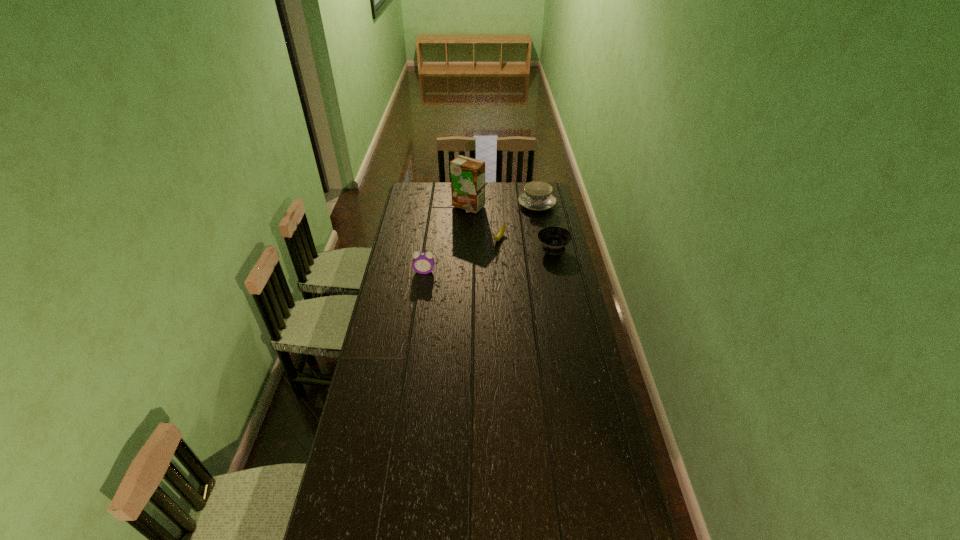
Locate which object is the second closest to the banana. Please provide its 2D coordinates. Your answer should be formatted as a tuple, i.e. [(x, y)], where the tuple contains the x and y coordinates of a point satisfying the conditions above.

[(467, 174)]

This screenshot has width=960, height=540. I want to click on object that is the fourth nearest to the tallest object, so click(423, 262).

Locate an element on the screen. free spot that satisfies the following two spatial constraints: 1. on the front side of the bowl; 2. on the left side of the carton is located at coordinates (467, 249).

Find the location of `free space that satisfies the following two spatial constraints: 1. on the back side of the third object from right to left; 2. on the left side of the chinaware`. free space that satisfies the following two spatial constraints: 1. on the back side of the third object from right to left; 2. on the left side of the chinaware is located at coordinates (496, 205).

Identify the location of vacant space that satisfies the following two spatial constraints: 1. on the front side of the fourth object from right to left; 2. on the left side of the bowl. (467, 249).